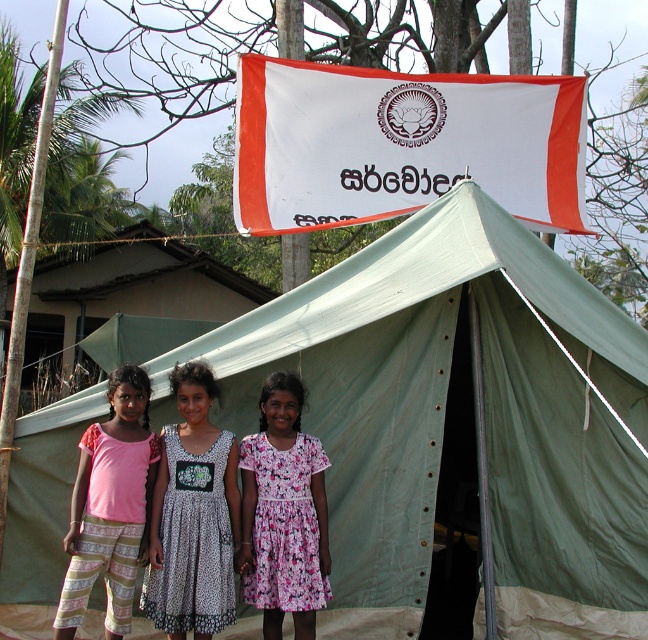
Is green canvas tent at center thinner than light pink fabric pants at lower left?

In fact, green canvas tent at center might be wider than light pink fabric pants at lower left.

Which is more to the left, green canvas tent at center or light pink fabric pants at lower left?

light pink fabric pants at lower left

You are a GUI agent. You are given a task and a screenshot of the screen. Output one action in this format:
    pyautogui.click(x=<x>, y=<y>)
    Task: Click on the green canvas tent at center
    The image size is (648, 640).
    Given the screenshot: What is the action you would take?
    pyautogui.click(x=457, y=426)

Which is below, green canvas tent at center or floral cotton dress at center?

Positioned lower is floral cotton dress at center.

Who is positioned more to the left, green canvas tent at center or floral cotton dress at center?

Positioned to the left is floral cotton dress at center.

Does point (303, 416) come in front of point (243, 557)?

No, (303, 416) is behind (243, 557).

Where is `green canvas tent at center`? green canvas tent at center is located at coordinates (457, 426).

Does floral cotton dress at center appear on the left side of light pink fabric pants at lower left?

No, floral cotton dress at center is not to the left of light pink fabric pants at lower left.

Does floral cotton dress at center have a greater height compared to light pink fabric pants at lower left?

No.

Which is behind, point (325, 490) or point (146, 556)?

Positioned behind is point (325, 490).

Identify the location of floral cotton dress at center. The width and height of the screenshot is (648, 640). (283, 513).